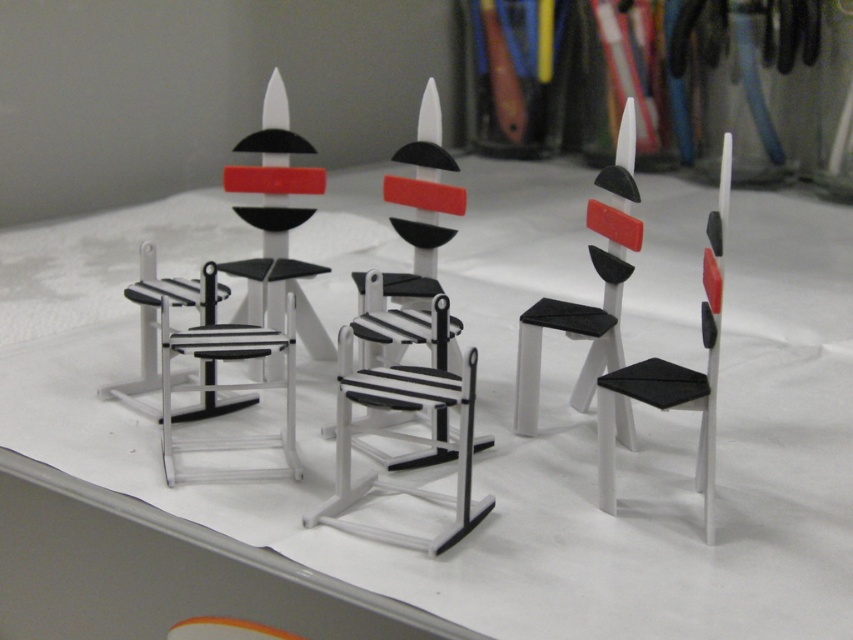
Does matte black chair at center appear over matte black chair at center right?

Correct, matte black chair at center is located above matte black chair at center right.

Does point (610, 268) come behind point (701, 376)?

Yes, point (610, 268) is behind point (701, 376).

What do you see at coordinates (583, 305) in the screenshot?
I see `matte black chair at center` at bounding box center [583, 305].

The height and width of the screenshot is (640, 853). I want to click on matte black chair at center, so click(x=583, y=305).

The height and width of the screenshot is (640, 853). What are the coordinates of `matte black chair at center` in the screenshot? It's located at (583, 305).

Does matte black chair at center right appear under matte black chair at left?

Indeed, matte black chair at center right is positioned under matte black chair at left.

You are a GUI agent. You are given a task and a screenshot of the screen. Output one action in this format:
    pyautogui.click(x=<x>, y=<y>)
    Task: Click on the matte black chair at center right
    Image resolution: width=853 pixels, height=640 pixels.
    Given the screenshot: What is the action you would take?
    pyautogui.click(x=676, y=371)